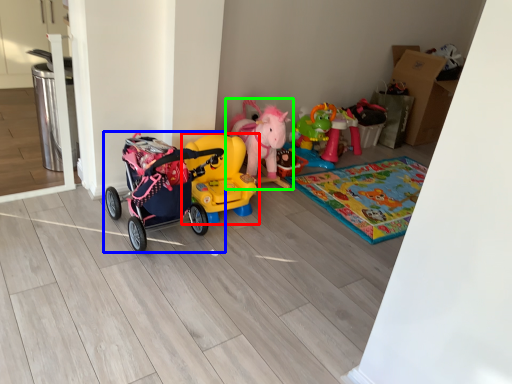
Question: Which object is positioned closest to toy (highlighted by a red box)? Select from toy (highlighted by a blue box) and toy (highlighted by a green box).

Choices:
 (A) toy
 (B) toy

Answer: (A)